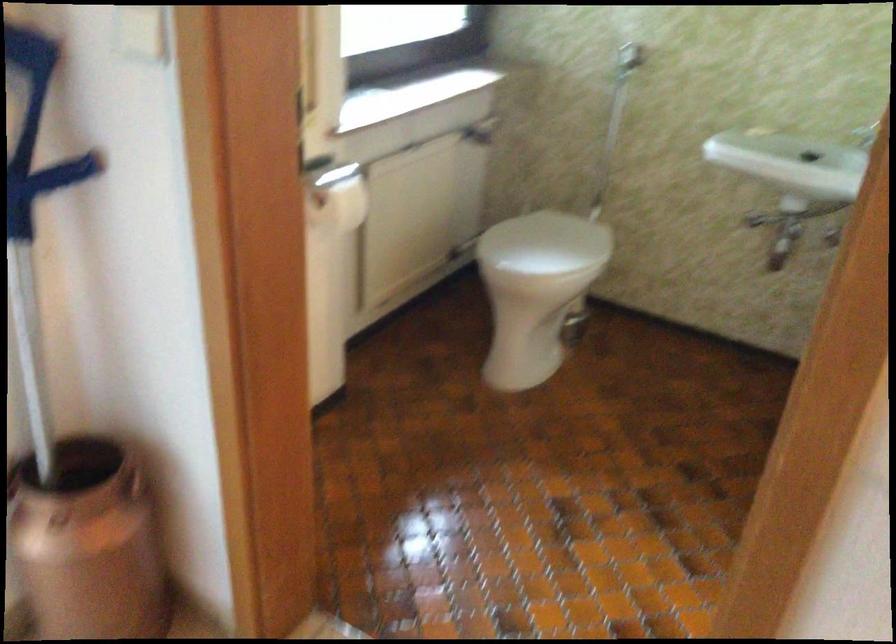
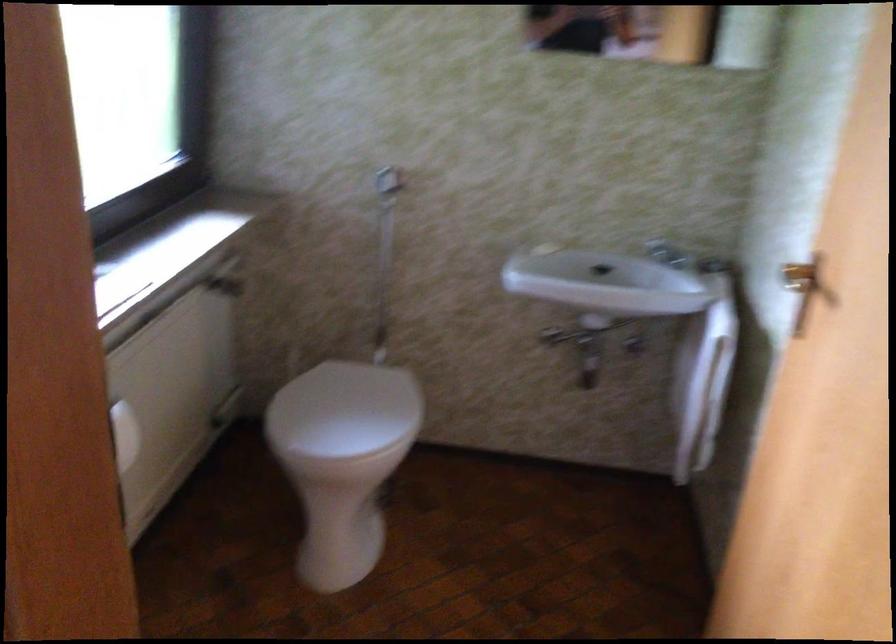
In the scene shown: What movement of the cameraman would produce the second image?

The cameraman moved toward left, forward.